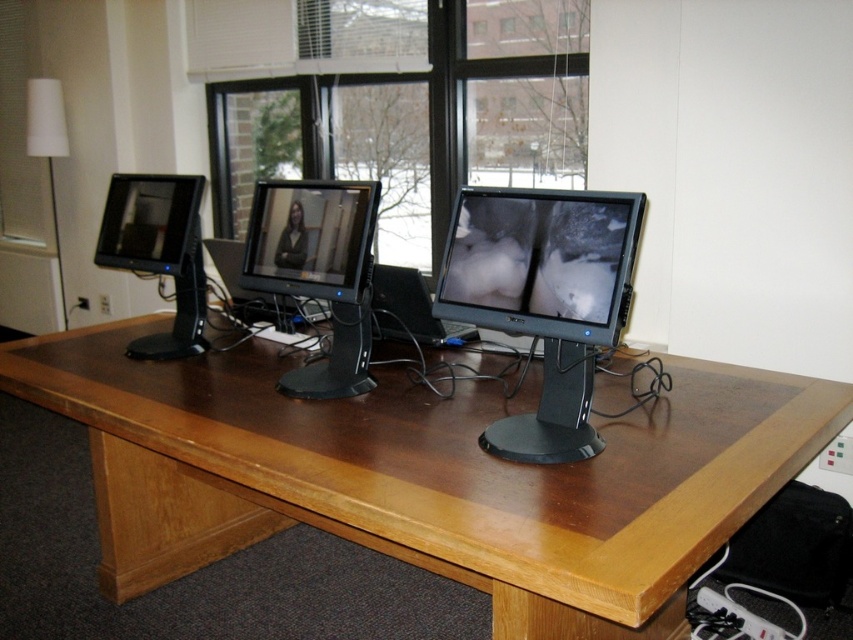
Question: Does transparent glass window at center have a larger size compared to matte black monitor at center?

Choices:
 (A) no
 (B) yes

Answer: (B)

Question: Does transparent glass window at center lie behind matte black monitor at left?

Choices:
 (A) no
 (B) yes

Answer: (B)

Question: Which is nearer to the matte black monitor at center?

Choices:
 (A) black glossy monitor at center
 (B) transparent glass window at center
 (C) matte black monitor at left

Answer: (C)

Question: Which object is farther from the camera taking this photo?

Choices:
 (A) black glossy monitor at center
 (B) matte black monitor at left
 (C) transparent glass window at center

Answer: (C)

Question: Can you confirm if transparent glass window at center is bigger than matte black monitor at center?

Choices:
 (A) no
 (B) yes

Answer: (B)

Question: Which point is farther to the camera?

Choices:
 (A) transparent glass window at center
 (B) matte black monitor at left

Answer: (A)